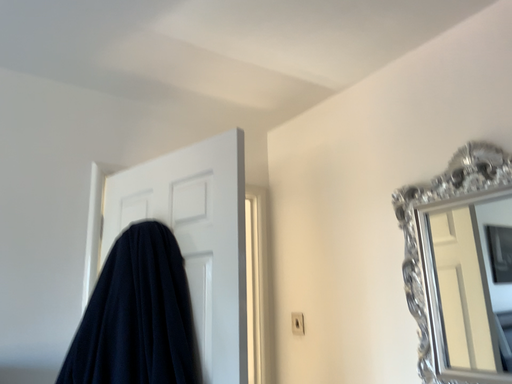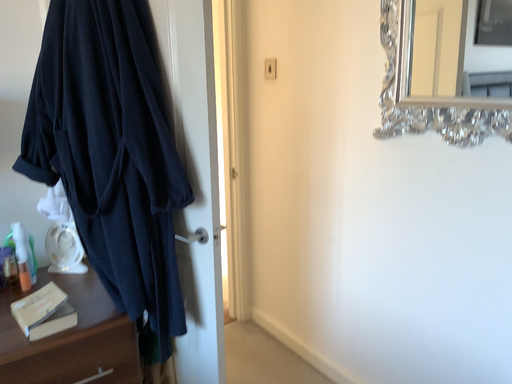
Question: How did the camera likely rotate when shooting the video?

Choices:
 (A) rotated upward
 (B) rotated downward

Answer: (B)